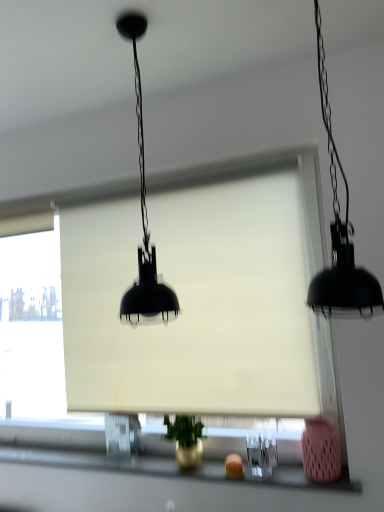
Where is `vacant area on top of matte black lampshade at center, the 1th lamp when ordered from left to right (from a real-world perspective)`? vacant area on top of matte black lampshade at center, the 1th lamp when ordered from left to right (from a real-world perspective) is located at coordinates (126, 22).